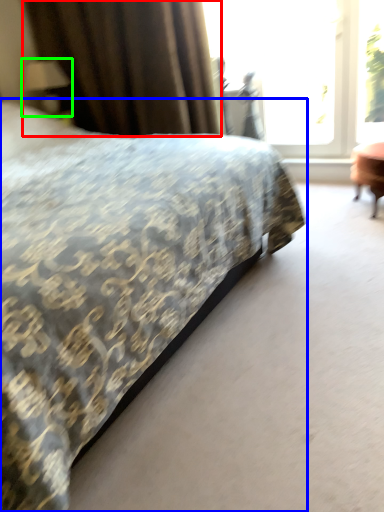
Question: Which object is positioned closest to curtain (highlighted by a red box)? Select from bed (highlighted by a blue box) and table lamp (highlighted by a green box).

Choices:
 (A) bed
 (B) table lamp

Answer: (B)